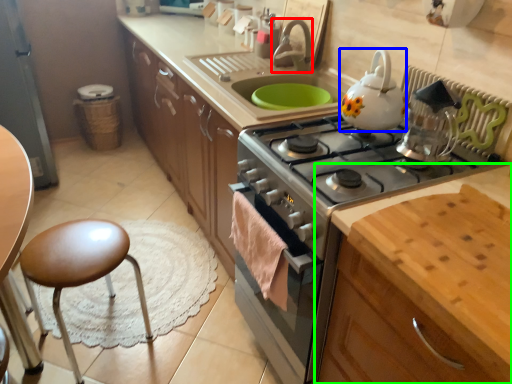
Question: Which is nearer to the faucet (highlighted by a red box)? kitchen appliance (highlighted by a blue box) or cabinetry (highlighted by a green box).

Choices:
 (A) kitchen appliance
 (B) cabinetry

Answer: (A)